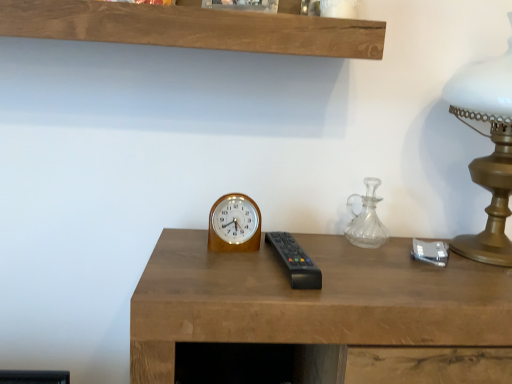
Identify the location of vacant region to the right of black plastic remote at center. Image resolution: width=512 pixels, height=384 pixels. (411, 287).